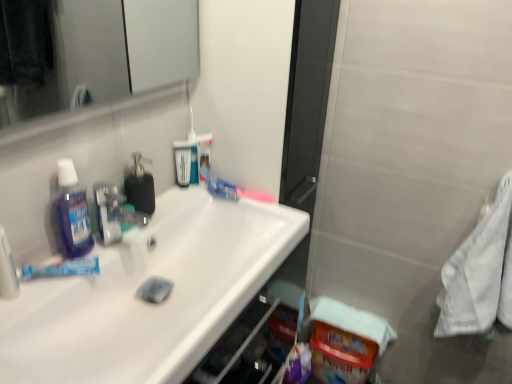
Question: Is translucent purple mouthwash at left, marked as the 3th mouthwash in a right-to-left arrangement, taller than white textured towel at right?

Choices:
 (A) yes
 (B) no

Answer: (B)

Question: Is translucent purple mouthwash at left, positioned as the 3th mouthwash in back-to-front order, turned away from white textured towel at right?

Choices:
 (A) no
 (B) yes

Answer: (A)

Question: Is white textured towel at right completely or partially inside translucent purple mouthwash at left, positioned as the 3th mouthwash in back-to-front order?

Choices:
 (A) yes
 (B) no

Answer: (B)

Question: Considering the relative positions of translucent purple mouthwash at left, marked as the 3th mouthwash in a right-to-left arrangement, and white textured towel at right in the image provided, is translucent purple mouthwash at left, marked as the 3th mouthwash in a right-to-left arrangement, behind white textured towel at right?

Choices:
 (A) yes
 (B) no

Answer: (B)

Question: Does point (73, 271) appear closer or farther from the camera than point (178, 172)?

Choices:
 (A) farther
 (B) closer

Answer: (B)

Question: Looking at their shapes, would you say blue matte toothpaste at left is wider or thinner than blue glossy mouthwash at upper center, which is counted as the 2th mouthwash, starting from the back?

Choices:
 (A) thin
 (B) wide

Answer: (B)

Question: From the image's perspective, is blue matte toothpaste at left positioned above or below blue glossy mouthwash at upper center, which is counted as the 2th mouthwash, starting from the back?

Choices:
 (A) above
 (B) below

Answer: (B)

Question: Visually, is blue matte toothpaste at left positioned to the left or to the right of blue glossy mouthwash at upper center, the 2th mouthwash positioned from the front?

Choices:
 (A) left
 (B) right

Answer: (A)

Question: Considering their positions, is blue glossy mouthwash at upper center, which is the 1th mouthwash from back to front, located in front of or behind black rubber soap dispenser at center?

Choices:
 (A) front
 (B) behind

Answer: (B)

Question: From the image's perspective, relative to black rubber soap dispenser at center, is blue glossy mouthwash at upper center, which ranks as the first mouthwash in right-to-left order, above or below?

Choices:
 (A) below
 (B) above

Answer: (B)

Question: Based on their positions, is blue glossy mouthwash at upper center, which is the 1th mouthwash from back to front, located to the left or right of black rubber soap dispenser at center?

Choices:
 (A) right
 (B) left

Answer: (A)

Question: Which is correct: blue glossy mouthwash at upper center, which ranks as the first mouthwash in right-to-left order, is inside black rubber soap dispenser at center, or outside of it?

Choices:
 (A) inside
 (B) outside

Answer: (B)

Question: From the image's perspective, is blue matte toothpaste at left positioned above or below translucent plastic toothbrush at upper center, which is counted as the 2th toothbrush, starting from the bottom?

Choices:
 (A) below
 (B) above

Answer: (A)

Question: Based on their sizes in the image, would you say blue matte toothpaste at left is bigger or smaller than translucent plastic toothbrush at upper center, placed as the 1th toothbrush when sorted from top to bottom?

Choices:
 (A) big
 (B) small

Answer: (B)